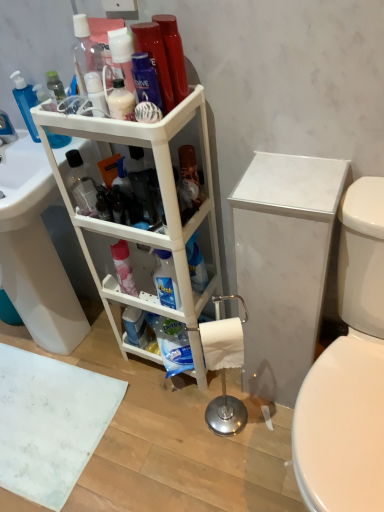
This screenshot has width=384, height=512. What are the coordinates of `vacant area that lies between white plastic shelf at center and white paper towel at center` in the screenshot? It's located at (180, 400).